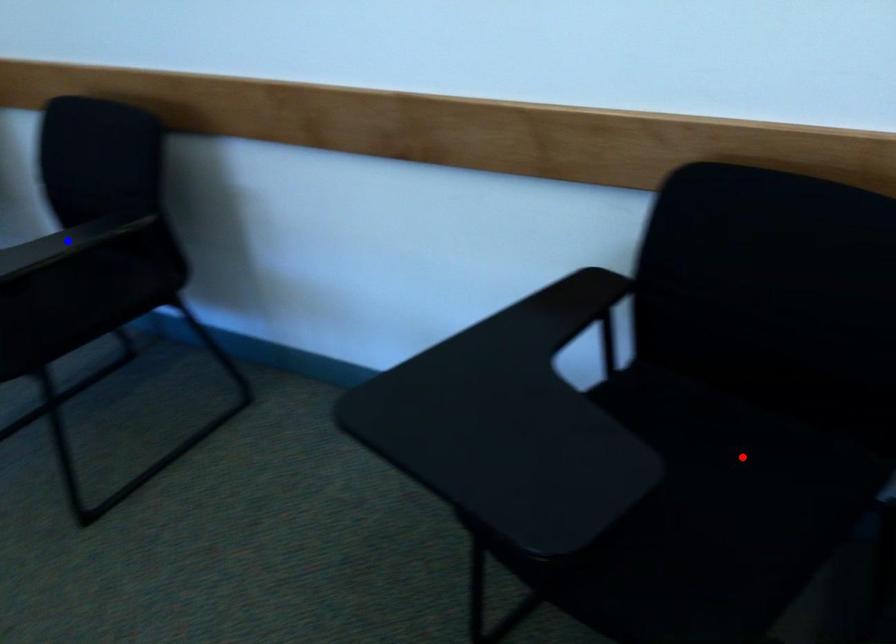
Question: In the image, two points are highlighted. Which point is nearer to the camera? Reply with the corresponding letter.

Choices:
 (A) blue point
 (B) red point

Answer: (B)